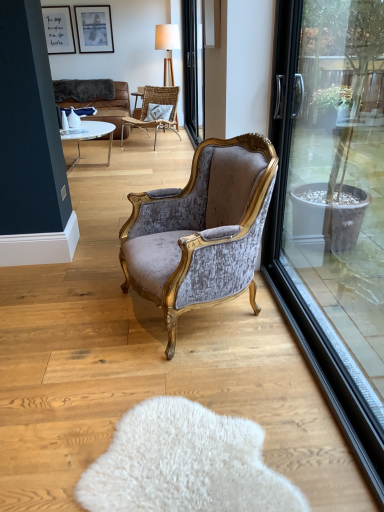
Question: Can you confirm if woven rattan chair at upper center, which ranks as the first chair in back-to-front order, is thinner than white glossy vase at center, marked as the 1th vase in a back-to-front arrangement?

Choices:
 (A) yes
 (B) no

Answer: (B)

Question: Is woven rattan chair at upper center, which ranks as the first chair in back-to-front order, facing away from white glossy vase at center, marked as the 1th vase in a back-to-front arrangement?

Choices:
 (A) yes
 (B) no

Answer: (B)

Question: Is woven rattan chair at upper center, marked as the 2th chair in a front-to-back arrangement, oriented towards white glossy vase at center, the 2th vase in the front-to-back sequence?

Choices:
 (A) yes
 (B) no

Answer: (A)

Question: From the image's perspective, does woven rattan chair at upper center, which ranks as the first chair in back-to-front order, appear lower than white glossy vase at center, the 2th vase in the front-to-back sequence?

Choices:
 (A) yes
 (B) no

Answer: (B)

Question: Considering the relative sizes of woven rattan chair at upper center, the 1th chair viewed from the top, and white glossy vase at center, the 2th vase in the front-to-back sequence, in the image provided, is woven rattan chair at upper center, the 1th chair viewed from the top, bigger than white glossy vase at center, the 2th vase in the front-to-back sequence,?

Choices:
 (A) no
 (B) yes

Answer: (B)

Question: From a real-world perspective, is woven rattan chair at upper center, marked as the 2th chair in a front-to-back arrangement, below white glossy vase at center, the 2th vase in the front-to-back sequence?

Choices:
 (A) no
 (B) yes

Answer: (B)

Question: Is matte black picture frame at upper left, which is the 2th picture frame in right-to-left order, turned away from velvet/goldenchair at center, the second chair in the top-to-bottom sequence?

Choices:
 (A) no
 (B) yes

Answer: (A)

Question: From the image's perspective, is matte black picture frame at upper left, the 1th picture frame viewed from the left, located beneath velvet/goldenchair at center, the second chair from the back?

Choices:
 (A) no
 (B) yes

Answer: (A)

Question: From a real-world perspective, is matte black picture frame at upper left, the 1th picture frame viewed from the left, physically below velvet/goldenchair at center, which is the first chair in bottom-to-top order?

Choices:
 (A) yes
 (B) no

Answer: (B)

Question: Can velvet/goldenchair at center, which is the first chair in bottom-to-top order, be found inside matte black picture frame at upper left, the 1th picture frame viewed from the left?

Choices:
 (A) no
 (B) yes

Answer: (A)

Question: Could you tell me if matte black picture frame at upper left, the 1th picture frame viewed from the left, is turned towards velvet/goldenchair at center, the second chair from the back?

Choices:
 (A) yes
 (B) no

Answer: (A)

Question: Considering the relative sizes of matte black picture frame at upper left, the 1th picture frame viewed from the left, and velvet/goldenchair at center, which is the first chair in bottom-to-top order, in the image provided, is matte black picture frame at upper left, the 1th picture frame viewed from the left, bigger than velvet/goldenchair at center, which is the first chair in bottom-to-top order,?

Choices:
 (A) no
 (B) yes

Answer: (A)

Question: Is wooden textured lamp at upper center facing towards velvet/goldenchair at center, the second chair in the top-to-bottom sequence?

Choices:
 (A) no
 (B) yes

Answer: (B)